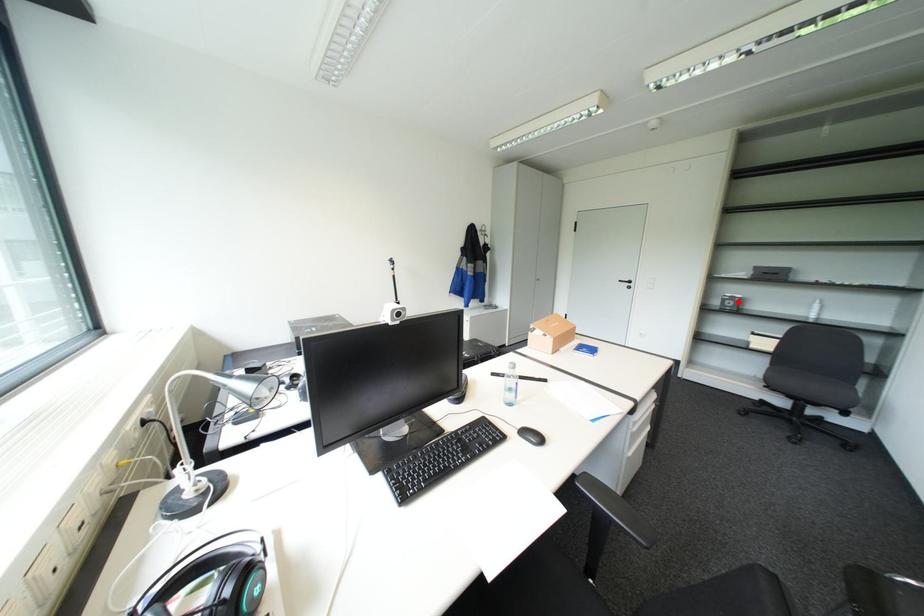
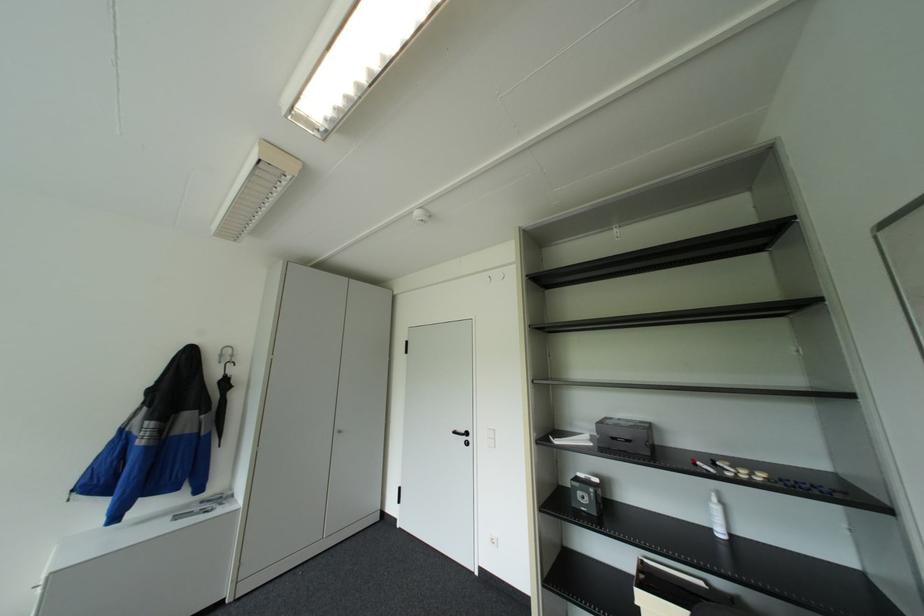
The point at the highlighted location is marked in the first image. Where is the corresponding point in the second image?

(591, 496)